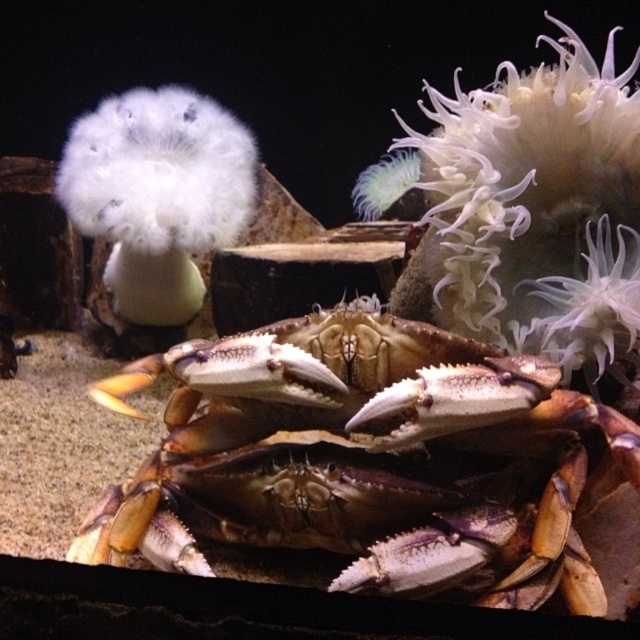
Which of these two, brown hard shell crab at center or white fluffy anemone at center, stands shorter?

brown hard shell crab at center

Who is lower down, brown hard shell crab at center or white fluffy anemone at center?

brown hard shell crab at center is below.

The width and height of the screenshot is (640, 640). Describe the element at coordinates (371, 460) in the screenshot. I see `brown hard shell crab at center` at that location.

The height and width of the screenshot is (640, 640). In order to click on brown hard shell crab at center in this screenshot , I will do `click(371, 460)`.